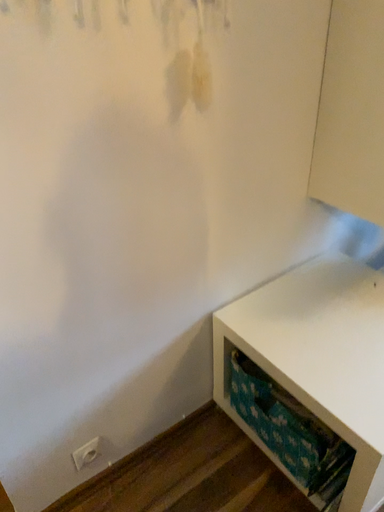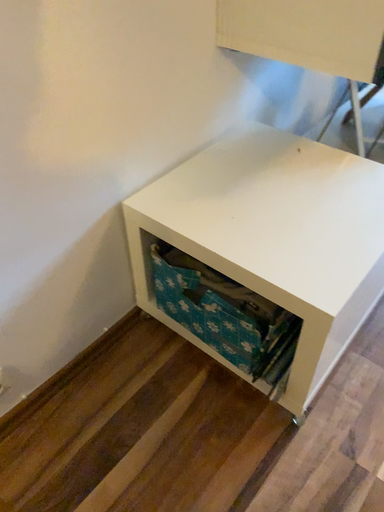
Question: How did the camera likely rotate when shooting the video?

Choices:
 (A) rotated left
 (B) rotated right

Answer: (B)